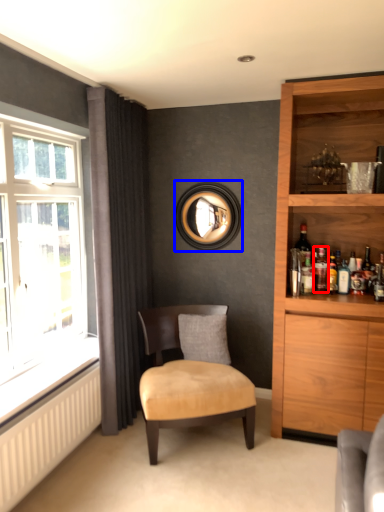
Question: Among these objects, which one is nearest to the camera, bottle (highlighted by a red box) or picture frame (highlighted by a blue box)?

Choices:
 (A) bottle
 (B) picture frame

Answer: (A)